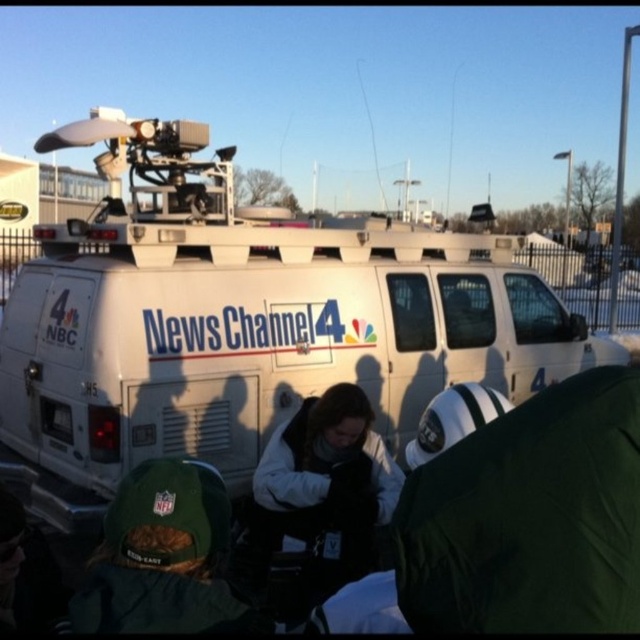
Question: Which point appears closest to the camera in this image?

Choices:
 (A) (620, 500)
 (B) (256, 557)
 (C) (166, 608)

Answer: (A)

Question: Is white van at center to the left of green fabric cap at lower left from the viewer's perspective?

Choices:
 (A) yes
 (B) no

Answer: (B)

Question: Estimate the real-world distances between objects in this image. Which object is closer to the green fabric cap at lower left?

Choices:
 (A) white van at center
 (B) green fabric jacket at lower right

Answer: (B)

Question: Is green fabric jacket at lower right to the left of green fabric cap at lower left from the viewer's perspective?

Choices:
 (A) yes
 (B) no

Answer: (B)

Question: Which object appears closest to the camera in this image?

Choices:
 (A) green fabric cap at lower left
 (B) green fabric jacket at lower right
 (C) white fleece jacket at center
 (D) white van at center

Answer: (B)

Question: Is white van at center wider than green fabric jacket at lower right?

Choices:
 (A) no
 (B) yes

Answer: (B)